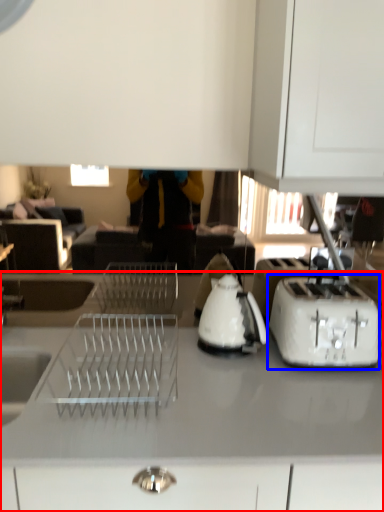
Question: Among these objects, which one is nearest to the camera, countertop (highlighted by a red box) or toaster (highlighted by a blue box)?

Choices:
 (A) countertop
 (B) toaster

Answer: (A)